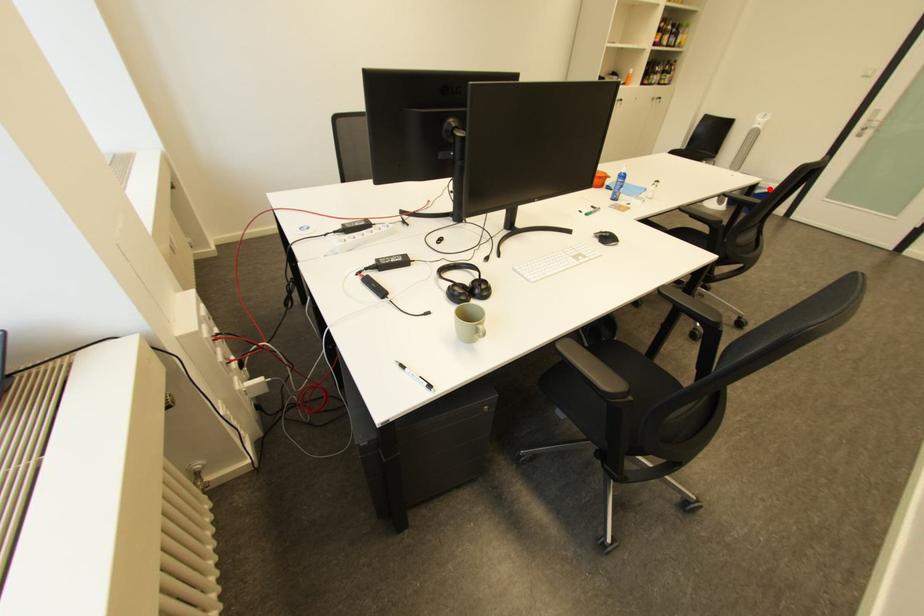
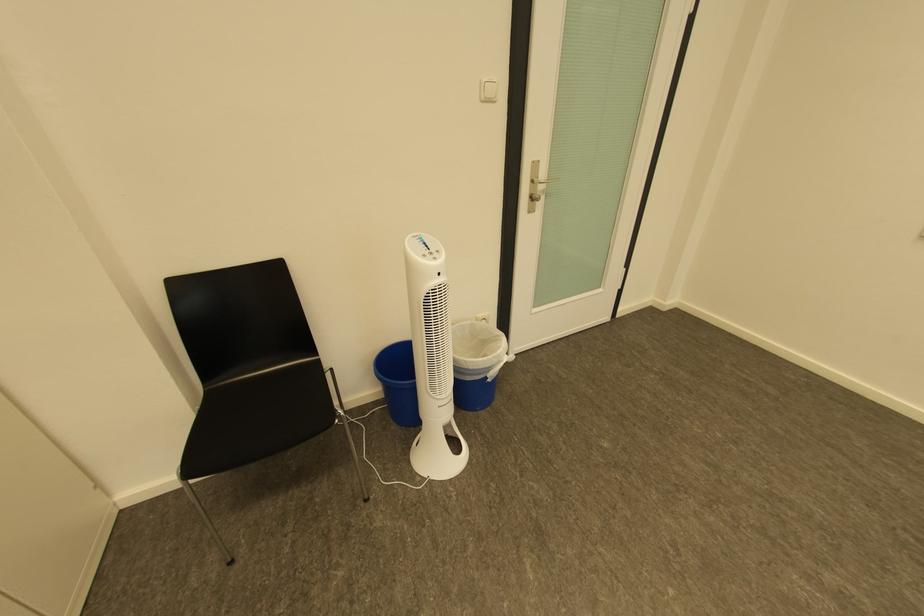
Question: I am providing you with two images of the same scene from different viewpoints. A red point is marked on the first image. At the location where the point appears in image 1, is it still visible in image 2?

Choices:
 (A) Yes
 (B) No

Answer: (A)